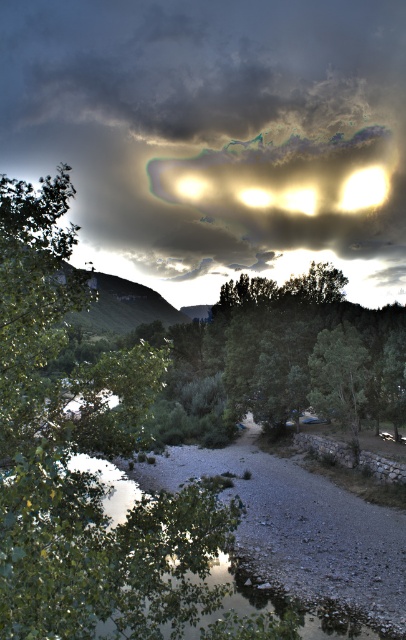
Question: Where is cloudy sky at upper center located in relation to green leafy tree at left in the image?

Choices:
 (A) left
 (B) right

Answer: (B)

Question: Which point is farther to the camera?

Choices:
 (A) (47, 205)
 (B) (192, 273)

Answer: (B)

Question: Does cloudy sky at upper center lie in front of green leafy tree at left?

Choices:
 (A) no
 (B) yes

Answer: (A)

Question: Which of the following is the closest to the observer?

Choices:
 (A) cloudy sky at upper center
 (B) green leafy tree at left

Answer: (B)

Question: Is cloudy sky at upper center bigger than green leafy tree at left?

Choices:
 (A) yes
 (B) no

Answer: (A)